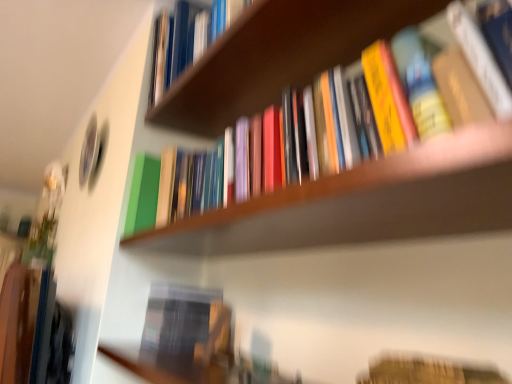
Question: Is wooden bookshelf at center positioned behind wooden bookshelf at upper center?

Choices:
 (A) no
 (B) yes

Answer: (A)

Question: Is wooden bookshelf at upper center at the back of wooden bookshelf at center?

Choices:
 (A) no
 (B) yes

Answer: (A)

Question: Considering the relative sizes of wooden bookshelf at center and wooden bookshelf at upper center in the image provided, is wooden bookshelf at center taller than wooden bookshelf at upper center?

Choices:
 (A) no
 (B) yes

Answer: (B)

Question: Is wooden bookshelf at center not inside wooden bookshelf at upper center?

Choices:
 (A) no
 (B) yes

Answer: (B)

Question: Can you confirm if wooden bookshelf at center is shorter than wooden bookshelf at upper center?

Choices:
 (A) yes
 (B) no

Answer: (B)

Question: Considering the relative positions of hardcover book at lower right, acting as the 1th book starting from the bottom, and wooden bookshelf at center in the image provided, is hardcover book at lower right, acting as the 1th book starting from the bottom, to the left or to the right of wooden bookshelf at center?

Choices:
 (A) left
 (B) right

Answer: (B)

Question: From the image's perspective, is hardcover book at lower right, the 3th book in the top-to-bottom sequence, above or below wooden bookshelf at center?

Choices:
 (A) below
 (B) above

Answer: (A)

Question: In terms of height, does hardcover book at lower right, the 3th book in the top-to-bottom sequence, look taller or shorter compared to wooden bookshelf at center?

Choices:
 (A) tall
 (B) short

Answer: (B)

Question: Is hardcover book at lower right, the 3th book in the top-to-bottom sequence, in front of or behind wooden bookshelf at center in the image?

Choices:
 (A) behind
 (B) front

Answer: (A)

Question: From a real-world perspective, relative to hardcover books at upper center, which is counted as the 2th book, starting from the bottom, is wooden bookshelf at center vertically above or below?

Choices:
 (A) below
 (B) above

Answer: (A)

Question: Is wooden bookshelf at center to the left or to the right of hardcover books at upper center, the 2th book positioned from the top, in the image?

Choices:
 (A) left
 (B) right

Answer: (A)

Question: Considering the positions of wooden bookshelf at center and hardcover books at upper center, the 2th book positioned from the top, in the image, is wooden bookshelf at center wider or thinner than hardcover books at upper center, the 2th book positioned from the top,?

Choices:
 (A) wide
 (B) thin

Answer: (A)

Question: From the image's perspective, relative to hardcover books at upper center, which is counted as the 2th book, starting from the bottom, is wooden bookshelf at center above or below?

Choices:
 (A) below
 (B) above

Answer: (A)

Question: In the image, is wooden bookshelf at upper center positioned in front of or behind wooden bookshelf at center?

Choices:
 (A) front
 (B) behind

Answer: (B)

Question: Is wooden bookshelf at upper center to the left or to the right of wooden bookshelf at center in the image?

Choices:
 (A) left
 (B) right

Answer: (A)